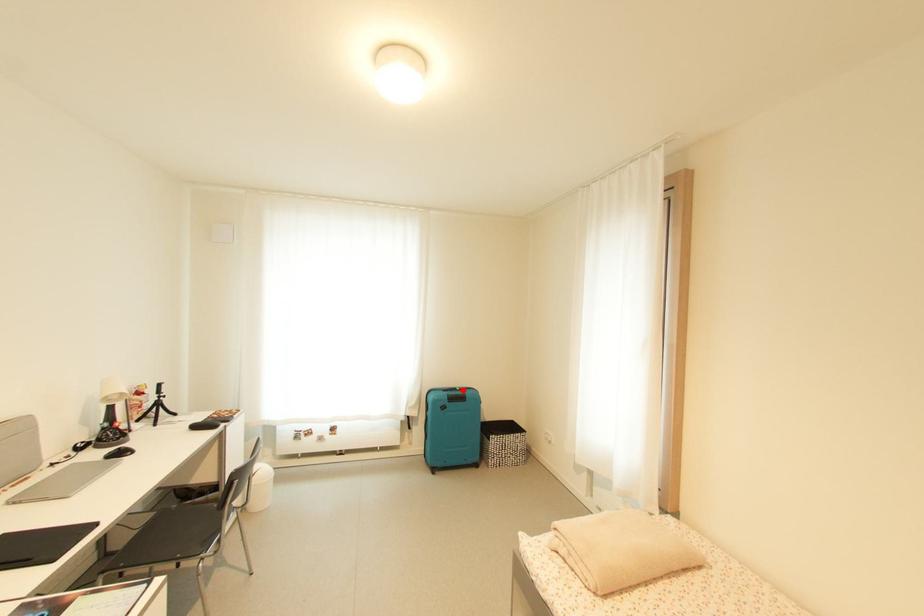
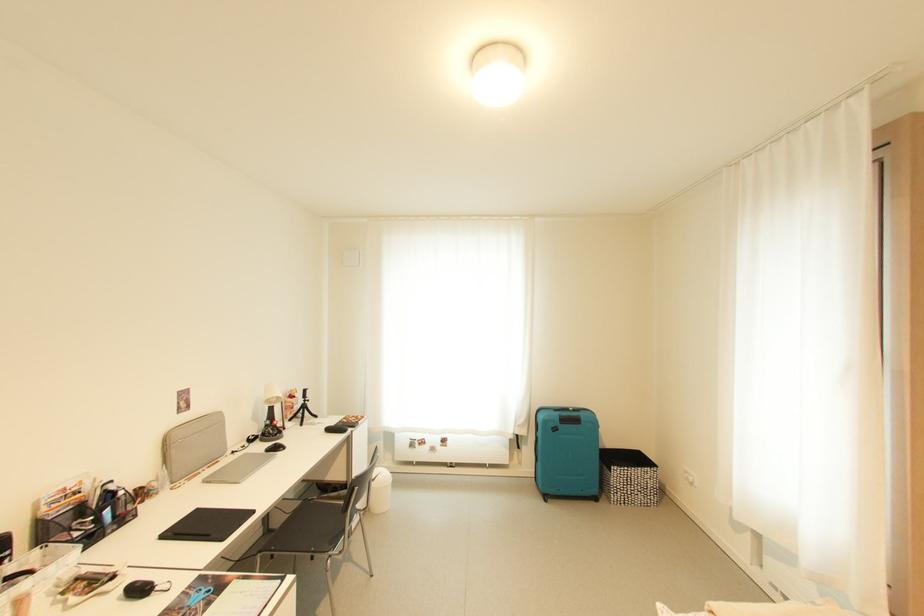
Where in the second image is the point corresponding to the highlighted location from the first image?

(576, 411)